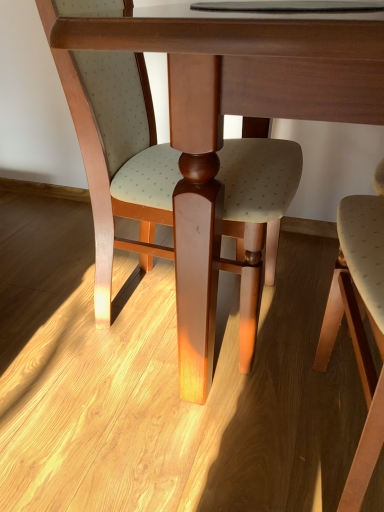
I want to click on vacant space in front of matte wood chair at center, so click(118, 444).